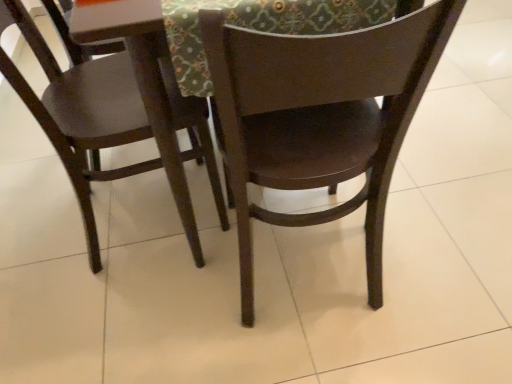
Question: Does point (150, 31) appear closer or farther from the camera than point (402, 79)?

Choices:
 (A) farther
 (B) closer

Answer: (A)

Question: From their relative heights in the image, would you say matte brown table at center is taller or shorter than dark wood chair at center, the first chair viewed from the right?

Choices:
 (A) short
 (B) tall

Answer: (A)

Question: Which of these objects is positioned farthest from the textured fabric at upper center?

Choices:
 (A) matte wood chair at left, which ranks as the 2th chair in right-to-left order
 (B) matte brown table at center
 (C) dark wood chair at center, arranged as the second chair when viewed from the left

Answer: (A)

Question: Considering the real-world distances, which object is closest to the dark wood chair at center, the first chair viewed from the right?

Choices:
 (A) textured fabric at upper center
 (B) matte brown table at center
 (C) matte wood chair at left, which is counted as the first chair, starting from the left

Answer: (A)